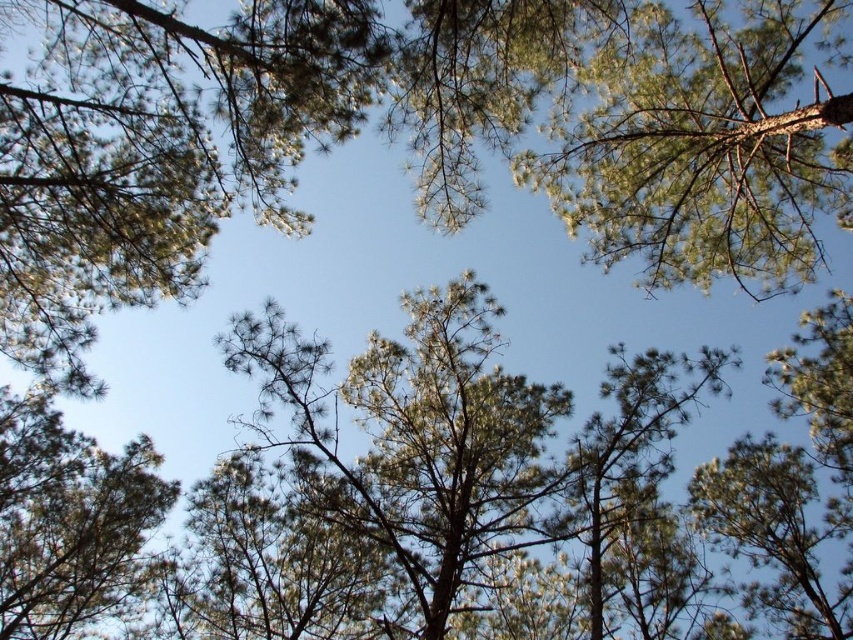
Between green needle-like at upper right and green needle-like at upper left, which one has more height?

With more height is green needle-like at upper right.

Who is more distant from viewer, (770, 225) or (30, 410)?

The point (30, 410) is more distant.

At what (x,y) coordinates should I click in order to perform the action: click on green needle-like at upper right. Please return your answer as a coordinate pair (x, y). The height and width of the screenshot is (640, 853). Looking at the image, I should click on (701, 147).

I want to click on green needle-like at upper right, so click(701, 147).